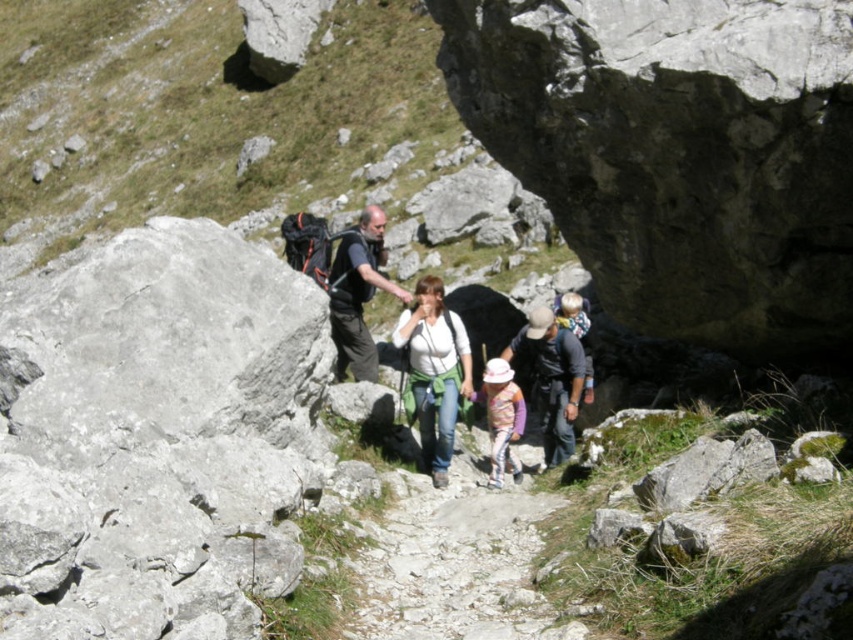
Based on the photo, does gray rocky trail at center have a greater height compared to purple fabric child at center?

No, gray rocky trail at center is not taller than purple fabric child at center.

Who is more distant from viewer, (451, 573) or (552, 320)?

Point (552, 320)

Identify the location of gray rocky trail at center. (453, 564).

This screenshot has width=853, height=640. Describe the element at coordinates (552, 378) in the screenshot. I see `purple fabric child at center` at that location.

Does purple fabric child at center appear over pastel pink fabric at center?

Indeed, purple fabric child at center is positioned over pastel pink fabric at center.

Is point (519, 337) more distant than point (502, 397)?

Yes, it is behind point (502, 397).

Find the location of `purple fabric child at center`. purple fabric child at center is located at coordinates (552, 378).

Does white fabric shirt at center have a lesser width compared to pastel pink fabric at center?

In fact, white fabric shirt at center might be wider than pastel pink fabric at center.

In order to click on white fabric shirt at center in this screenshot , I will do `click(434, 372)`.

Locate an element on the screen. white fabric shirt at center is located at coordinates (434, 372).